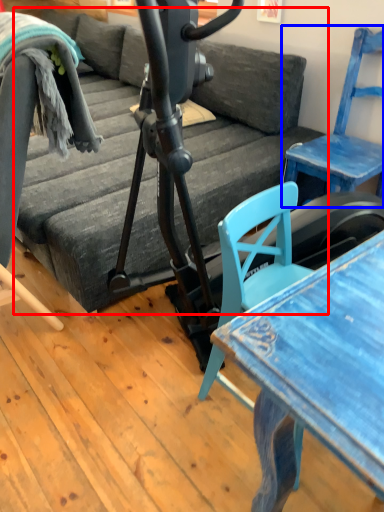
Question: Which of the following is the closest to the observer, studio couch (highlighted by a red box) or chair (highlighted by a blue box)?

Choices:
 (A) studio couch
 (B) chair

Answer: (A)